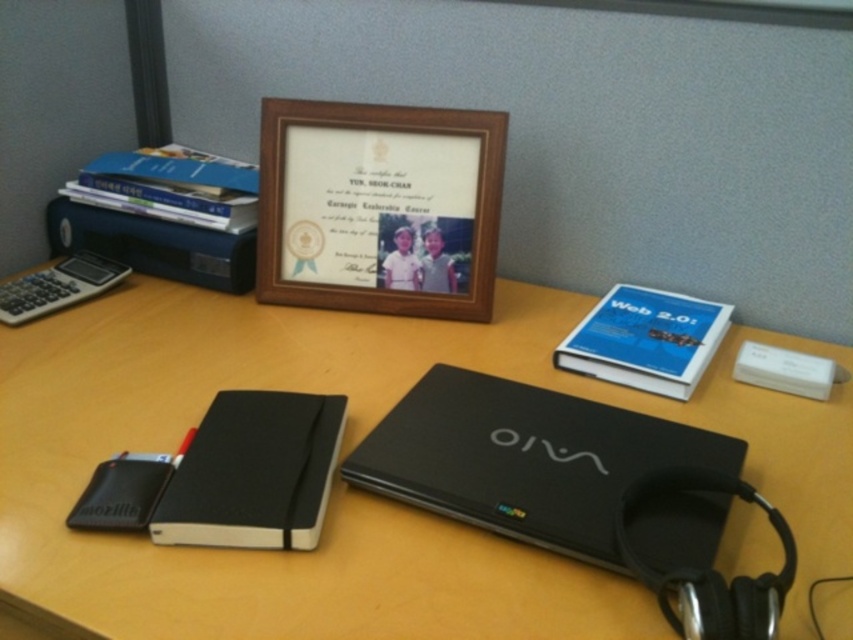
Question: Does black matte notebook at center appear on the left side of blue matte book at upper right?

Choices:
 (A) yes
 (B) no

Answer: (A)

Question: Which object is closer to the camera taking this photo?

Choices:
 (A) matte black laptop at center
 (B) black matte notebook at center
 (C) blue matte book at upper right
 (D) black rubberized earphone at lower right

Answer: (D)

Question: Can you confirm if blue matte book at upper right is positioned to the left of black rubberized earphone at lower right?

Choices:
 (A) no
 (B) yes

Answer: (A)

Question: Does black matte laptop at center come behind black matte notebook at center?

Choices:
 (A) yes
 (B) no

Answer: (B)

Question: Which of the following is the farthest from the observer?

Choices:
 (A) black matte laptop at center
 (B) wooden picture frame at upper center
 (C) black matte notebook at center
 (D) matte black laptop at center

Answer: (B)

Question: Which of the following is the farthest from the observer?

Choices:
 (A) wooden picture frame at upper center
 (B) matte black laptop at center
 (C) blue matte book at upper right

Answer: (A)